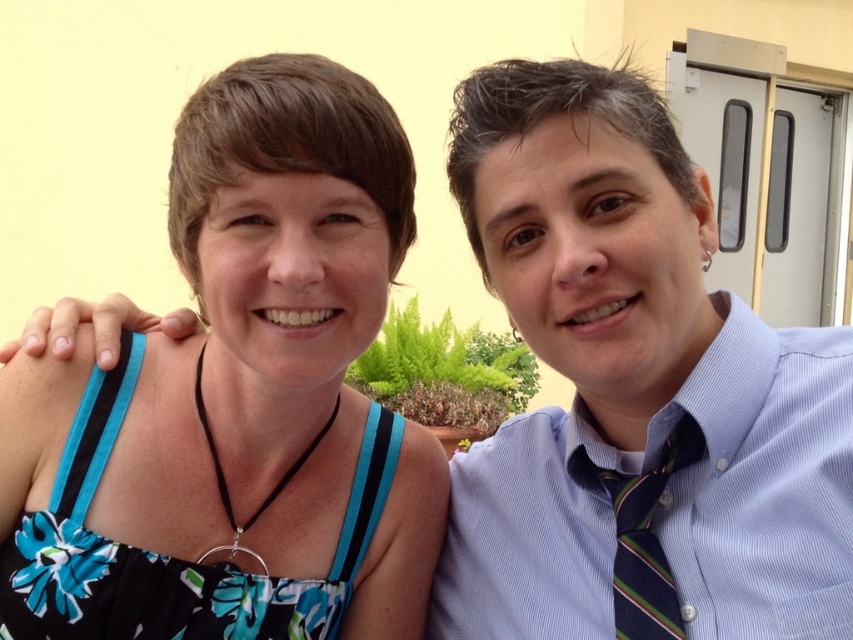
Question: Which of these objects is positioned farthest from the striped fabric tie at right?

Choices:
 (A) light blue striped shirt at right
 (B) black floral fabric dress at left
 (C) blue floral dress at left

Answer: (B)

Question: Can you confirm if blue floral dress at left is bigger than light blue striped shirt at right?

Choices:
 (A) yes
 (B) no

Answer: (A)

Question: Among these objects, which one is farthest from the camera?

Choices:
 (A) blue floral dress at left
 (B) light blue striped shirt at right
 (C) black floral fabric dress at left
 (D) striped fabric tie at right

Answer: (C)

Question: Does blue floral dress at left appear over light blue striped shirt at right?

Choices:
 (A) no
 (B) yes

Answer: (B)

Question: Considering the real-world distances, which object is closest to the striped fabric tie at right?

Choices:
 (A) black floral fabric dress at left
 (B) light blue striped shirt at right
 (C) blue floral dress at left

Answer: (B)

Question: Where is black floral fabric dress at left located in relation to striped fabric tie at right in the image?

Choices:
 (A) right
 (B) left

Answer: (B)